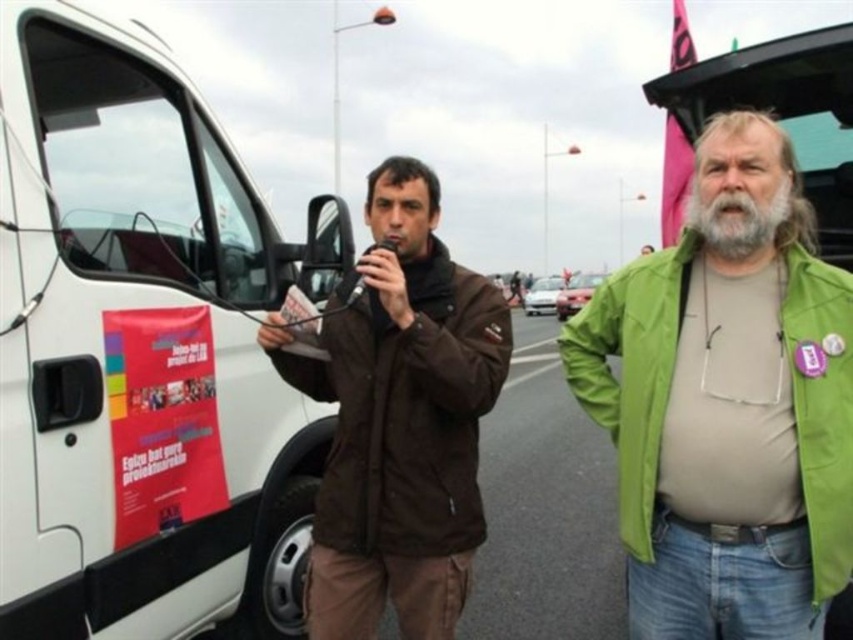
Question: Is white matte van at left further to the viewer compared to brown matte jacket at center?

Choices:
 (A) yes
 (B) no

Answer: (B)

Question: Which point is closer to the camera?

Choices:
 (A) white glossy car at center
 (B) metallic silver car at center

Answer: (B)

Question: Is brown matte jacket at center to the left of graywoollybeard at right from the viewer's perspective?

Choices:
 (A) yes
 (B) no

Answer: (A)

Question: Estimate the real-world distances between objects in this image. Which object is farther from the metallic silver car at center?

Choices:
 (A) brown matte jacket at center
 (B) white glossy car at center
 (C) graywoollybeard at right
 (D) white matte van at left

Answer: (C)

Question: Which object is positioned farthest from the brown matte jacket at center?

Choices:
 (A) metallic silver car at center
 (B) white matte van at left

Answer: (A)

Question: Is the position of graywoollybeard at right less distant than that of metallic silver car at center?

Choices:
 (A) yes
 (B) no

Answer: (A)